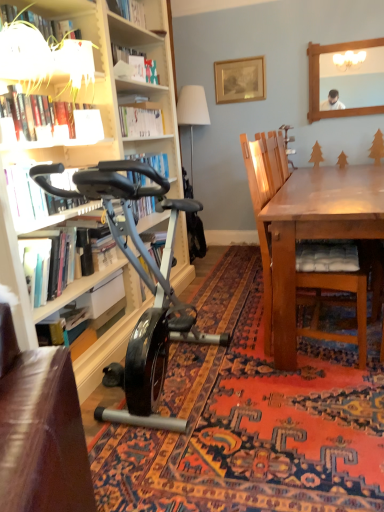
Question: From the image's perspective, is white paper at upper center, which is counted as the 1th shelf, starting from the top, on top of hardcover book at lower left, the 1th book in the bottom-to-top sequence?

Choices:
 (A) no
 (B) yes

Answer: (B)

Question: Is white paper at upper center, placed as the 2th shelf when sorted from front to back, positioned before hardcover book at lower left, the 1th book in the bottom-to-top sequence?

Choices:
 (A) no
 (B) yes

Answer: (A)

Question: Considering the relative sizes of white paper at upper center, which is counted as the first shelf, starting from the right, and hardcover book at lower left, the 1th book in the bottom-to-top sequence, in the image provided, is white paper at upper center, which is counted as the first shelf, starting from the right, taller than hardcover book at lower left, the 1th book in the bottom-to-top sequence,?

Choices:
 (A) no
 (B) yes

Answer: (B)

Question: From the image's perspective, is white paper at upper center, the 1th shelf positioned from the back, beneath hardcover book at lower left, the 1th book in the bottom-to-top sequence?

Choices:
 (A) no
 (B) yes

Answer: (A)

Question: Is white paper at upper center, placed as the 2th shelf when sorted from front to back, not near hardcover book at lower left, positioned as the fourth book in top-to-bottom order?

Choices:
 (A) yes
 (B) no

Answer: (A)

Question: Is white paper at upper center, which is the second shelf from left to right, further to the viewer compared to hardcover book at lower left, positioned as the fourth book in top-to-bottom order?

Choices:
 (A) yes
 (B) no

Answer: (A)

Question: Does white paper at upper center, which is the second shelf from left to right, lie behind wooden chair with cushion at right?

Choices:
 (A) yes
 (B) no

Answer: (A)

Question: Considering the relative sizes of white paper at upper center, which appears as the 2th shelf when ordered from the bottom, and wooden chair with cushion at right in the image provided, is white paper at upper center, which appears as the 2th shelf when ordered from the bottom, thinner than wooden chair with cushion at right?

Choices:
 (A) yes
 (B) no

Answer: (A)

Question: Is white paper at upper center, which appears as the 2th shelf when ordered from the bottom, to the left of wooden chair with cushion at right from the viewer's perspective?

Choices:
 (A) no
 (B) yes

Answer: (B)

Question: Are white paper at upper center, which is counted as the 1th shelf, starting from the top, and wooden chair with cushion at right making contact?

Choices:
 (A) no
 (B) yes

Answer: (A)

Question: Considering the relative sizes of white paper at upper center, which is counted as the first shelf, starting from the right, and wooden chair with cushion at right in the image provided, is white paper at upper center, which is counted as the first shelf, starting from the right, bigger than wooden chair with cushion at right?

Choices:
 (A) no
 (B) yes

Answer: (A)

Question: From a real-world perspective, is white paper at upper center, which is the second shelf from left to right, on top of wooden chair with cushion at right?

Choices:
 (A) yes
 (B) no

Answer: (A)

Question: Is gold-framed picture at upper center positioned in front of white paper at upper center, which is counted as the 1th shelf, starting from the top?

Choices:
 (A) yes
 (B) no

Answer: (B)